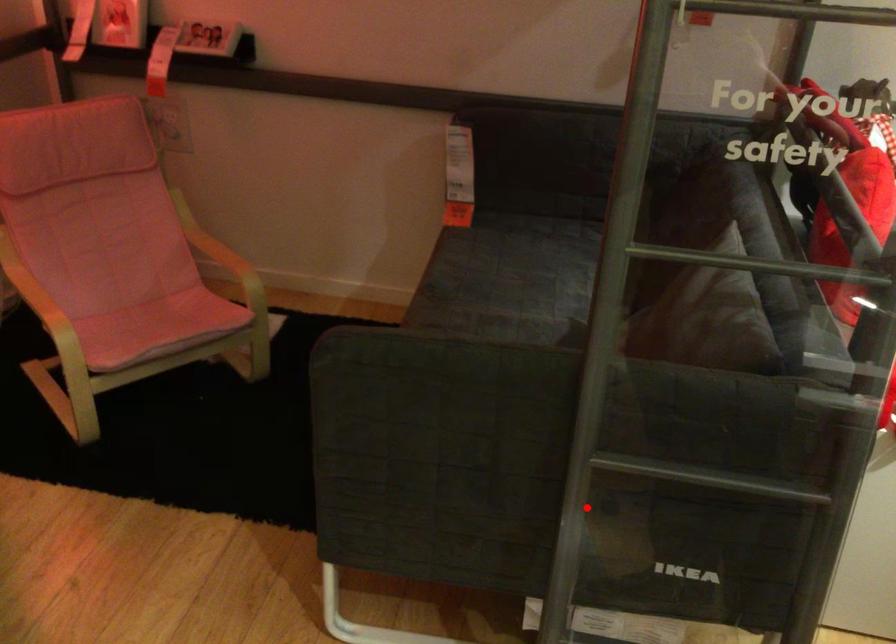
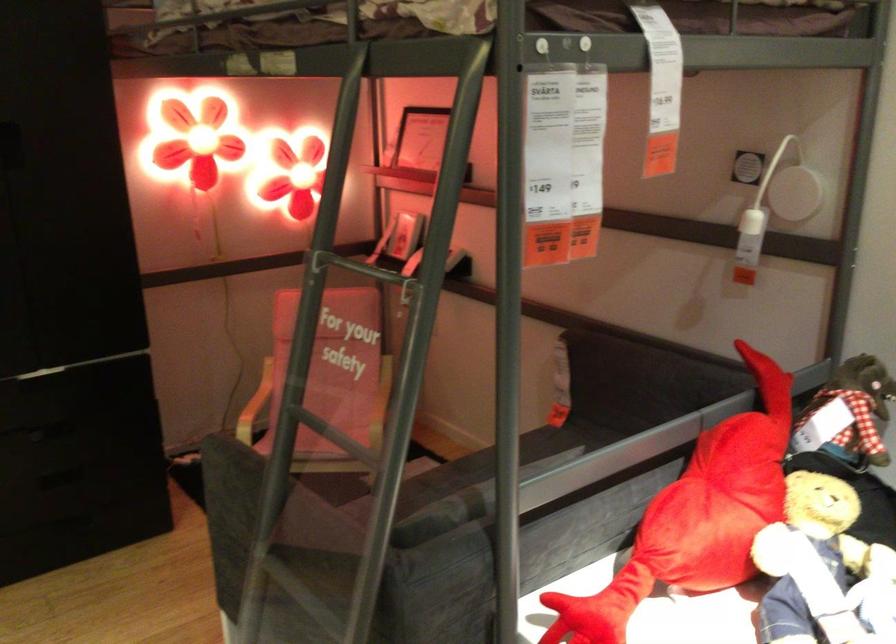
In the second image, find the point that corresponds to the highlighted location in the first image.

(293, 609)